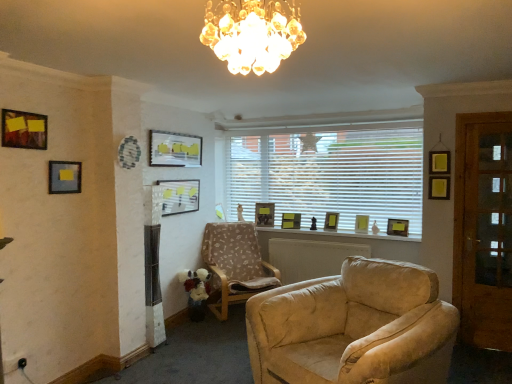
Question: Is patterned fabric armchair at center to the right of matte glass picture frame at upper center, marked as the third picture frame in a left-to-right arrangement, from the viewer's perspective?

Choices:
 (A) yes
 (B) no

Answer: (A)

Question: Is patterned fabric armchair at center behind matte glass picture frame at upper center, which appears as the third picture frame when viewed from the front?

Choices:
 (A) no
 (B) yes

Answer: (B)

Question: Would you say patterned fabric armchair at center contains matte glass picture frame at upper center, which appears as the third picture frame when viewed from the front?

Choices:
 (A) yes
 (B) no

Answer: (B)

Question: Is patterned fabric armchair at center smaller than matte glass picture frame at upper center, which appears as the third picture frame when viewed from the front?

Choices:
 (A) no
 (B) yes

Answer: (A)

Question: Is patterned fabric armchair at center oriented away from matte glass picture frame at upper center, which is counted as the seventh picture frame, starting from the right?

Choices:
 (A) no
 (B) yes

Answer: (A)

Question: From the image's perspective, is matte gold picture frame at center, the fifth picture frame when ordered from left to right, above or below matte glass picture frame at upper center, which appears as the third picture frame when viewed from the front?

Choices:
 (A) below
 (B) above

Answer: (A)

Question: Is matte gold picture frame at center, which is the ninth picture frame from front to back, inside the boundaries of matte glass picture frame at upper center, the seventh picture frame when ordered from back to front, or outside?

Choices:
 (A) inside
 (B) outside

Answer: (B)

Question: Considering the relative positions of matte gold picture frame at center, acting as the first picture frame starting from the back, and matte glass picture frame at upper center, the seventh picture frame when ordered from back to front, in the image provided, is matte gold picture frame at center, acting as the first picture frame starting from the back, to the left or to the right of matte glass picture frame at upper center, the seventh picture frame when ordered from back to front,?

Choices:
 (A) left
 (B) right

Answer: (B)

Question: From their relative heights in the image, would you say matte gold picture frame at center, acting as the first picture frame starting from the back, is taller or shorter than matte glass picture frame at upper center, marked as the third picture frame in a left-to-right arrangement?

Choices:
 (A) tall
 (B) short

Answer: (B)

Question: Considering the positions of matte black picture frame at center, the fourth picture frame from the front, and matte green picture frame at center, acting as the 2th picture frame starting from the back, in the image, is matte black picture frame at center, the fourth picture frame from the front, wider or thinner than matte green picture frame at center, acting as the 2th picture frame starting from the back,?

Choices:
 (A) thin
 (B) wide

Answer: (A)

Question: Considering the positions of matte black picture frame at center, positioned as the 6th picture frame in right-to-left order, and matte green picture frame at center, acting as the 2th picture frame starting from the back, in the image, is matte black picture frame at center, positioned as the 6th picture frame in right-to-left order, bigger or smaller than matte green picture frame at center, acting as the 2th picture frame starting from the back,?

Choices:
 (A) big
 (B) small

Answer: (A)

Question: Is matte black picture frame at center, positioned as the 6th picture frame in right-to-left order, to the left or to the right of matte green picture frame at center, acting as the 2th picture frame starting from the back, in the image?

Choices:
 (A) left
 (B) right

Answer: (A)

Question: Choose the correct answer: Is matte black picture frame at center, the fourth picture frame from the front, inside matte green picture frame at center, acting as the 2th picture frame starting from the back, or outside it?

Choices:
 (A) inside
 (B) outside

Answer: (B)

Question: In the image, is matte gold picture frame at center, the 3th picture frame when ordered from right to left, on the left side or the right side of white blinds at center?

Choices:
 (A) right
 (B) left

Answer: (A)

Question: From the image's perspective, is matte gold picture frame at center, which is the seventh picture frame in front-to-back order, positioned above or below white blinds at center?

Choices:
 (A) above
 (B) below

Answer: (B)